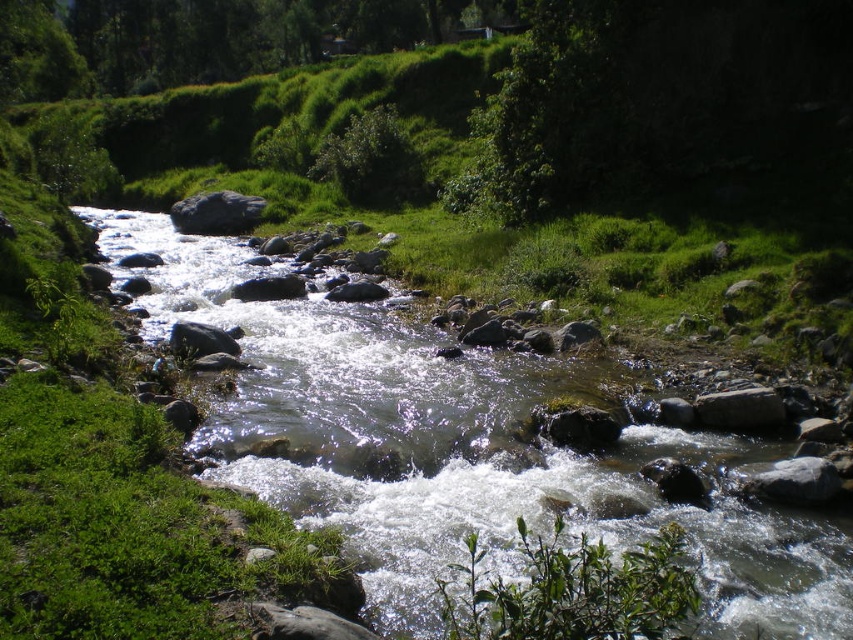
Question: From the image, what is the correct spatial relationship of green leafy tree at upper center in relation to gray smooth rock at center?

Choices:
 (A) left
 (B) right

Answer: (A)

Question: Which object is the farthest from the green leafy tree at upper center?

Choices:
 (A) gray smooth rock at center
 (B) clear water at center

Answer: (B)

Question: Which point is closer to the camera?

Choices:
 (A) gray smooth rock at center
 (B) clear water at center
 (C) green leafy tree at upper center

Answer: (B)

Question: From the image, what is the correct spatial relationship of clear water at center in relation to green leafy tree at upper center?

Choices:
 (A) right
 (B) left

Answer: (A)

Question: Which point is closer to the camera?

Choices:
 (A) green leafy tree at upper center
 (B) clear water at center
 (C) gray smooth rock at center

Answer: (B)

Question: Is clear water at center further to the viewer compared to gray smooth rock at center?

Choices:
 (A) yes
 (B) no

Answer: (B)